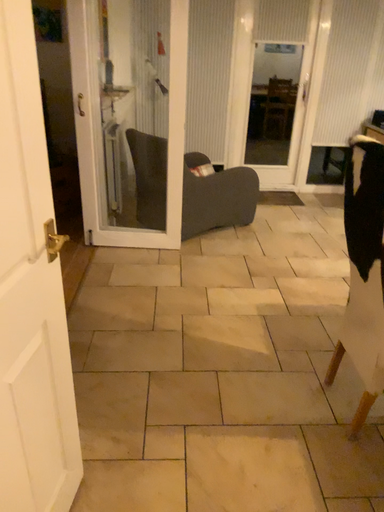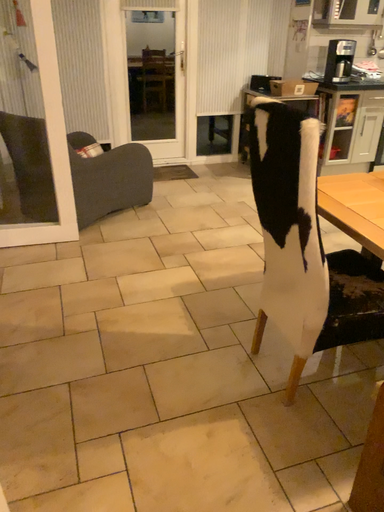
Question: Which way did the camera rotate in the video?

Choices:
 (A) rotated left
 (B) rotated right

Answer: (B)